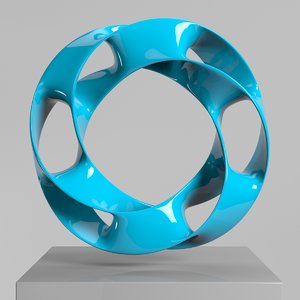
Where is `art`? art is located at coordinates (152, 43).